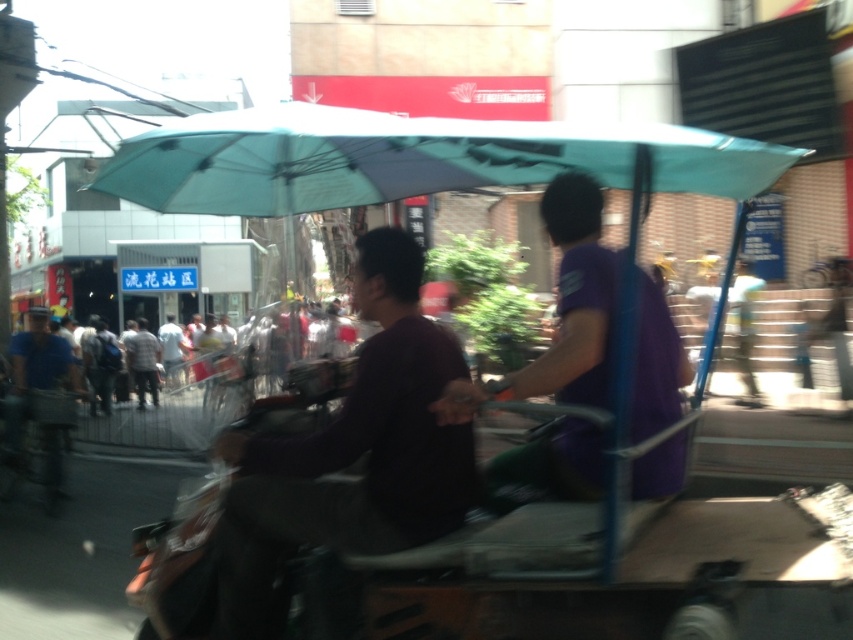
Question: Does dark purple shirt at center come behind light gray shirt at center?

Choices:
 (A) no
 (B) yes

Answer: (A)

Question: Observing the image, what is the correct spatial positioning of blue uniform at left in reference to light gray shirt at center?

Choices:
 (A) above
 (B) below

Answer: (B)

Question: Among these points, which one is farthest from the camera?

Choices:
 (A) (555, 241)
 (B) (44, 344)

Answer: (B)

Question: Can you confirm if dark purple shirt at center is positioned above blue uniform at left?

Choices:
 (A) no
 (B) yes

Answer: (A)

Question: Among these points, which one is farthest from the camera?

Choices:
 (A) (218, 627)
 (B) (548, 483)

Answer: (B)

Question: Which of the following is the farthest from the observer?

Choices:
 (A) metallic purple golf cart at center
 (B) light gray shirt at center
 (C) dark purple shirt at center
 (D) purple matte shirt at center

Answer: (B)